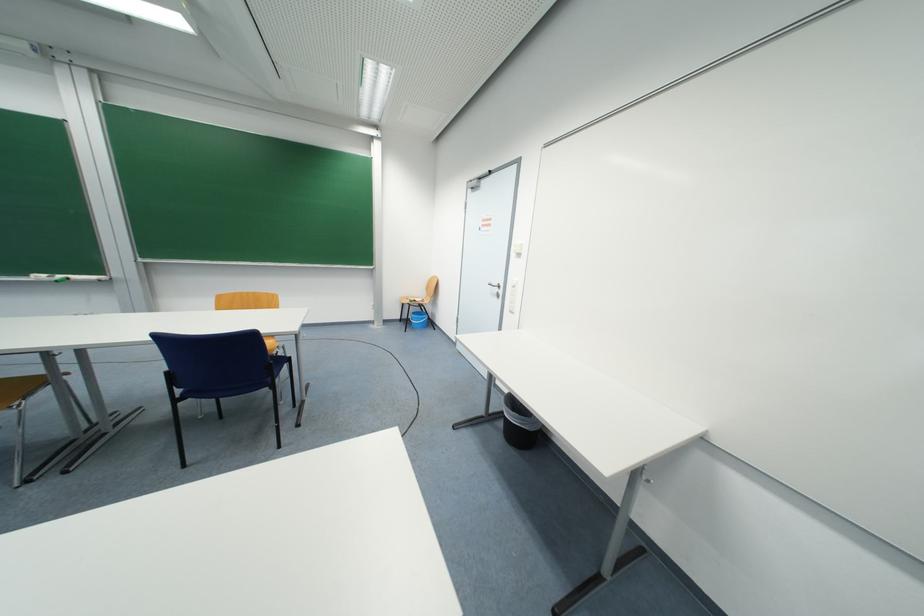
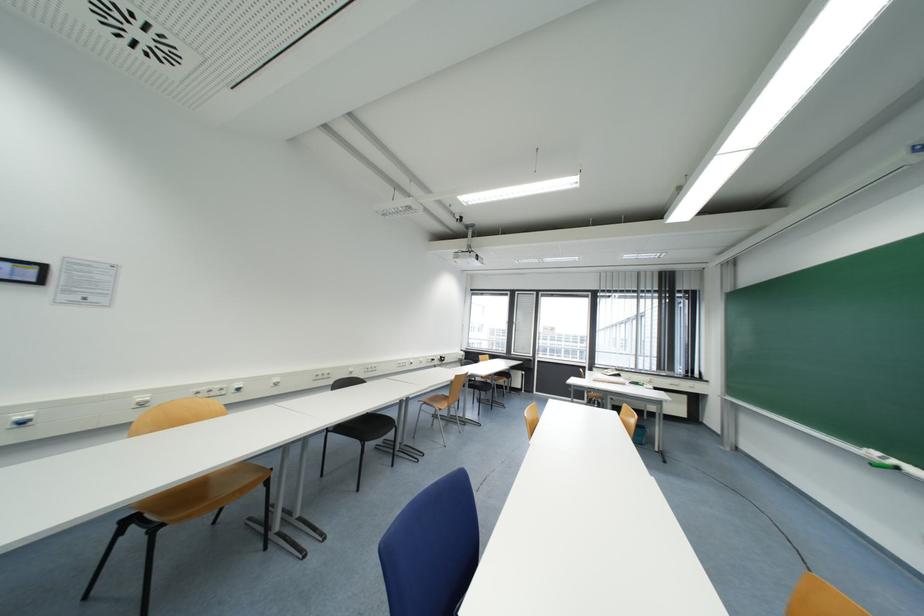
The point at (66,278) is marked in the first image. Where is the corresponding point in the second image?

(898, 464)